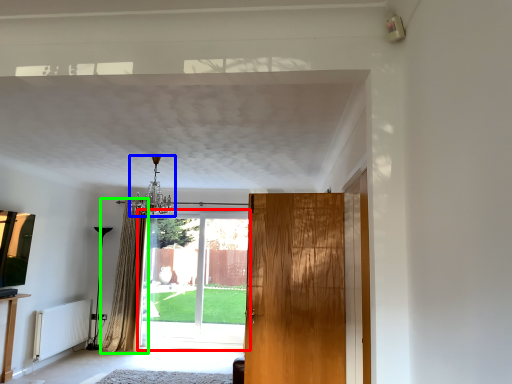
Question: Which object is positioned farthest from door (highlighted by a red box)? Select from light fixture (highlighted by a blue box) and curtain (highlighted by a green box).

Choices:
 (A) light fixture
 (B) curtain

Answer: (A)